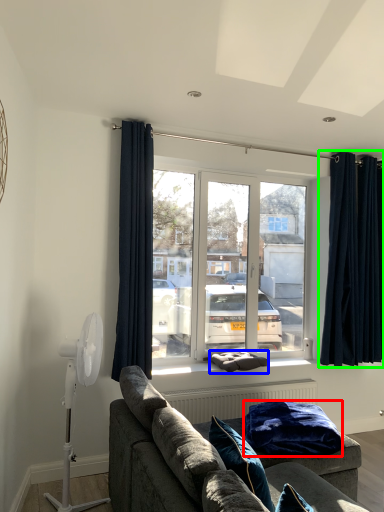
Question: Which object is the closest to the blanket (highlighted by a red box)? Choose among these: pillow (highlighted by a blue box) or curtain (highlighted by a green box).

Choices:
 (A) pillow
 (B) curtain

Answer: (A)